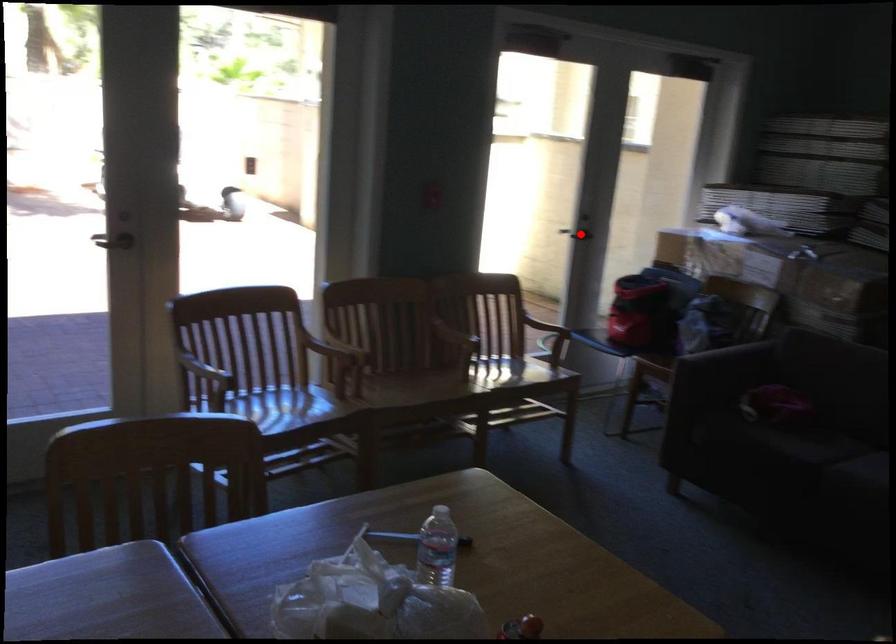
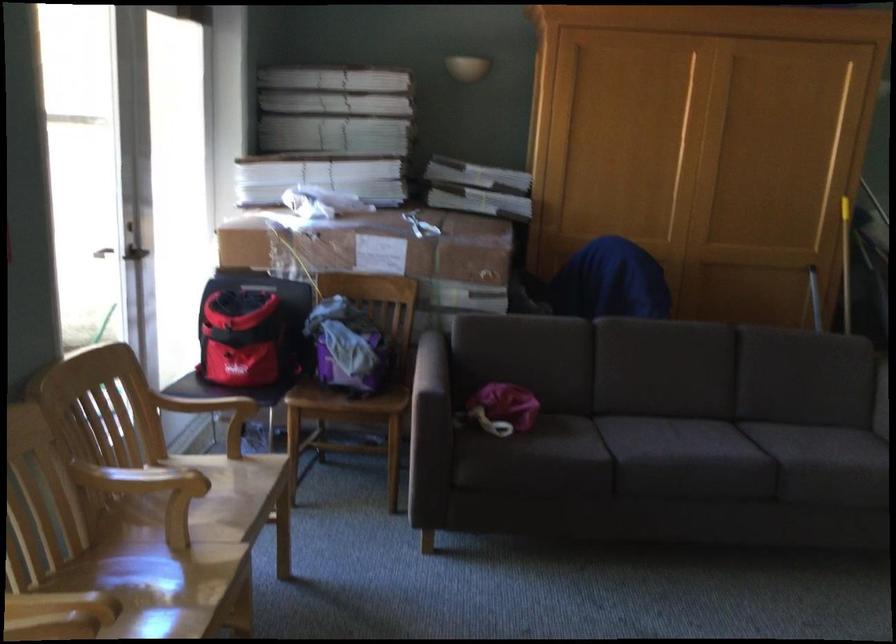
The point at the highlighted location is marked in the first image. Where is the corresponding point in the second image?

(132, 272)